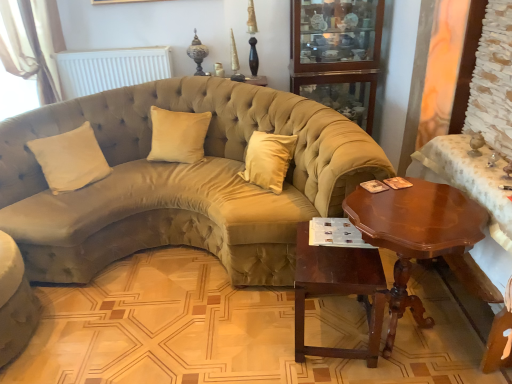
Question: Is point (401, 301) closer or farther from the camera than point (228, 251)?

Choices:
 (A) closer
 (B) farther

Answer: (A)

Question: Is shiny brown wood coffee table at right in front of or behind suede beige couch at center, which is the first studio couch in right-to-left order, in the image?

Choices:
 (A) front
 (B) behind

Answer: (A)

Question: Which object is positioned closest to the suede beige couch at center, which ranks as the 2th studio couch in left-to-right order?

Choices:
 (A) beige fabric curtain at upper left
 (B) mahogany wood table at lower center
 (C) glass cabinet at upper center
 (D) velvet beige couch at lower left, which is the 1th studio couch from left to right
 (E) beige velvet pillow at center, acting as the second pillow starting from the left

Answer: (E)

Question: Which object is positioned closest to the mahogany wood table at lower center?

Choices:
 (A) shiny brown wood coffee table at right
 (B) beige fabric curtain at upper left
 (C) white matte radiator at upper center
 (D) glass cabinet at upper center
 (E) beige velvet pillow at center, the 1th pillow from the right

Answer: (A)